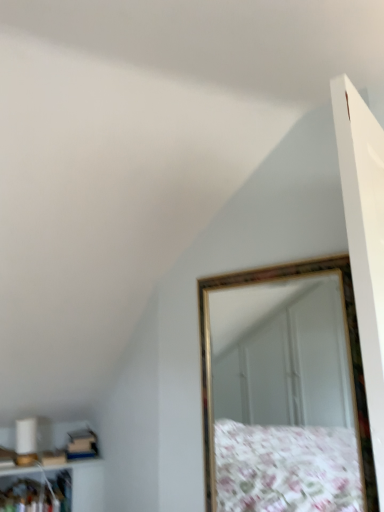
Question: Does white glossy cabinet at lower left have a greater width compared to gold-framed mirror at upper right?

Choices:
 (A) no
 (B) yes

Answer: (B)

Question: Is white glossy cabinet at lower left further to camera compared to gold-framed mirror at upper right?

Choices:
 (A) no
 (B) yes

Answer: (B)

Question: Is white glossy cabinet at lower left smaller than gold-framed mirror at upper right?

Choices:
 (A) yes
 (B) no

Answer: (B)

Question: From the image's perspective, is white glossy cabinet at lower left located beneath gold-framed mirror at upper right?

Choices:
 (A) yes
 (B) no

Answer: (A)

Question: Are white glossy cabinet at lower left and gold-framed mirror at upper right making contact?

Choices:
 (A) no
 (B) yes

Answer: (A)

Question: Is gold-framed mirror at upper right completely or partially inside white glossy cabinet at lower left?

Choices:
 (A) no
 (B) yes

Answer: (A)

Question: Considering the relative positions of gold-framed mirror at upper right and white glossy cabinet at lower left in the image provided, is gold-framed mirror at upper right to the right of white glossy cabinet at lower left from the viewer's perspective?

Choices:
 (A) no
 (B) yes

Answer: (B)

Question: Considering the relative sizes of gold-framed mirror at upper right and white glossy cabinet at lower left in the image provided, is gold-framed mirror at upper right taller than white glossy cabinet at lower left?

Choices:
 (A) yes
 (B) no

Answer: (A)

Question: Is the depth of gold-framed mirror at upper right greater than that of white glossy cabinet at lower left?

Choices:
 (A) yes
 (B) no

Answer: (B)

Question: Can you confirm if gold-framed mirror at upper right is wider than white glossy cabinet at lower left?

Choices:
 (A) no
 (B) yes

Answer: (A)

Question: From the image's perspective, would you say gold-framed mirror at upper right is shown under white glossy cabinet at lower left?

Choices:
 (A) yes
 (B) no

Answer: (B)

Question: Is white glossy cabinet at lower left surrounded by gold-framed mirror at upper right?

Choices:
 (A) no
 (B) yes

Answer: (A)

Question: Would you say white glossy cabinet at lower left is inside or outside gold-framed mirror at upper right?

Choices:
 (A) outside
 (B) inside

Answer: (A)